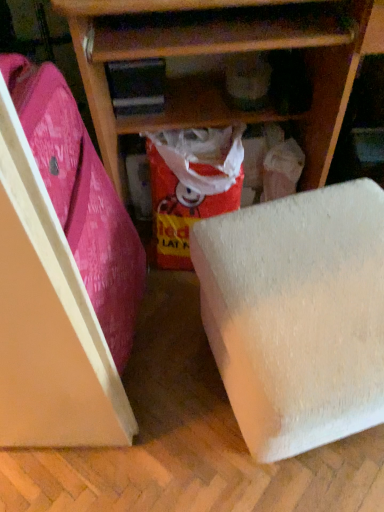
You are a GUI agent. You are given a task and a screenshot of the screen. Output one action in this format:
    pyautogui.click(x=<x>, y=<y>)
    Task: Click on the free space to the left of white foam block at lower right
    
    Given the screenshot: What is the action you would take?
    pyautogui.click(x=165, y=408)